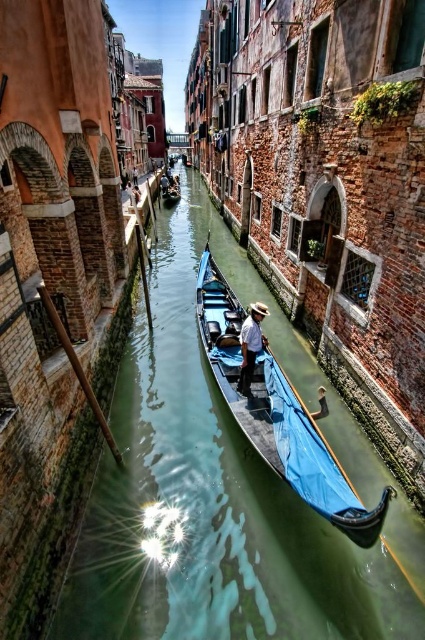
What is the relationship between the width of the blue fabric boat at center and the light brown straw hat at center?

The blue fabric boat at center is wider than the light brown straw hat at center.

You are standing on the bridge overlooking the green smooth water at center and the blue fabric boat at center. Which object appears taller from your viewpoint?

The green smooth water at center appears taller than the blue fabric boat at center from the bridge.

You are a tourist in Venice and want to take a photo of the green smooth water at center and the blue fabric boat at center from the bridge. The camera you have can only focus on objects within 10 feet. Can you capture both objects in one clear shot?

The green smooth water at center and blue fabric boat at center are 11.30 feet apart from each other. Since the camera can only focus on objects within 10 feet, the distance between them exceeds the camera focus range. Therefore, you cannot capture both objects in one clear shot.